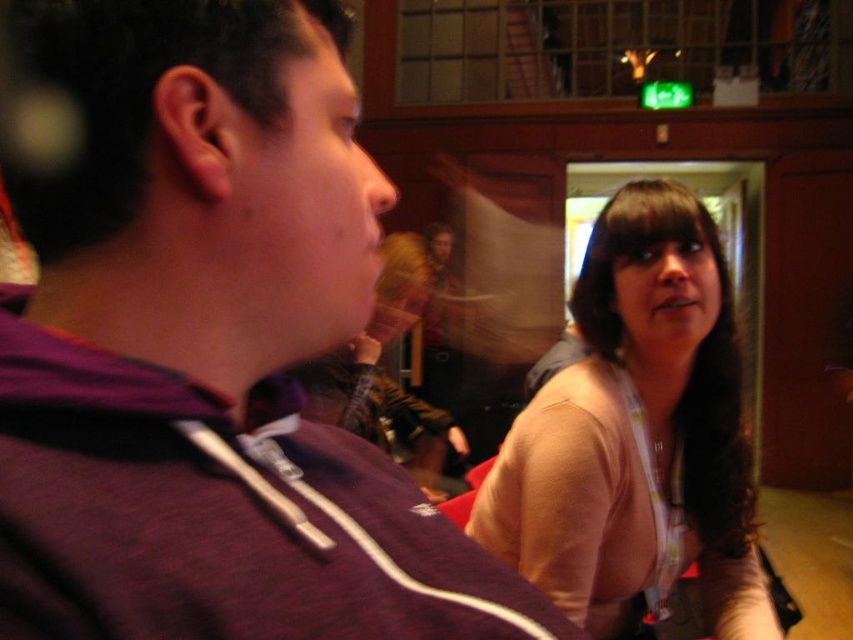
Which is above, purple fleece at center or light beige sweater at center?

purple fleece at center is above.

Can you confirm if purple fleece at center is positioned to the right of light beige sweater at center?

Incorrect, purple fleece at center is not on the right side of light beige sweater at center.

Which is in front, point (363, 513) or point (643, 321)?

Positioned in front is point (363, 513).

What are the coordinates of `purple fleece at center` in the screenshot? It's located at (202, 342).